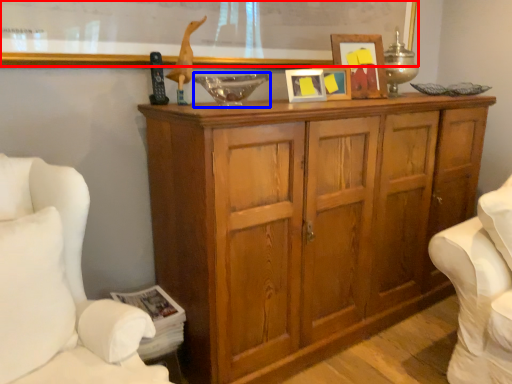
Question: Among these objects, which one is nearest to the camera, bulletin board (highlighted by a red box) or glass bowl (highlighted by a blue box)?

Choices:
 (A) bulletin board
 (B) glass bowl

Answer: (A)